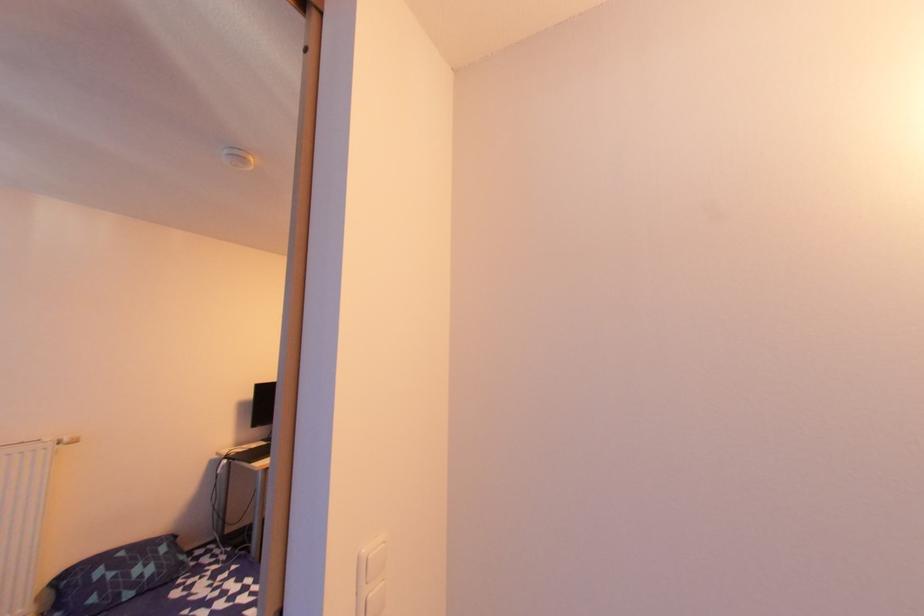
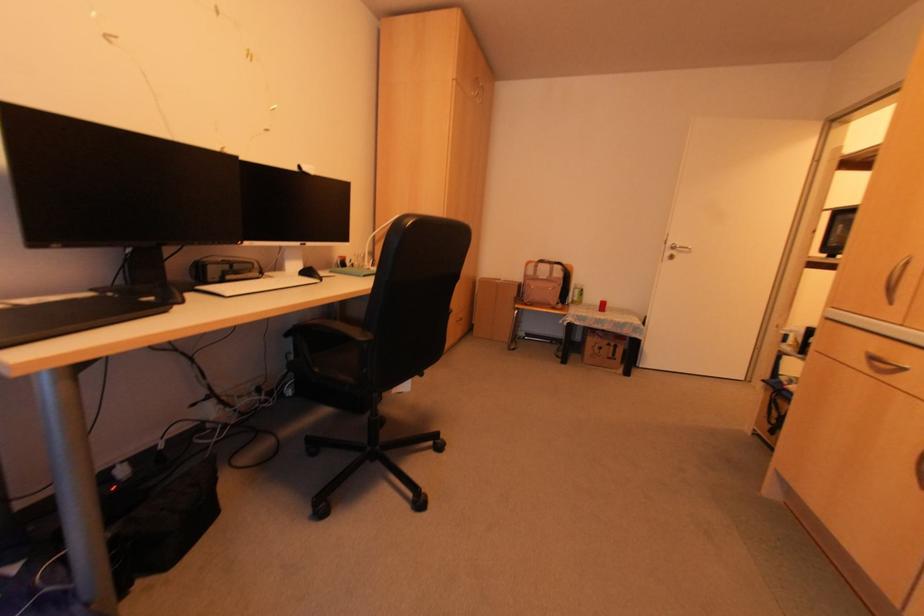
The images are taken continuously from a first-person perspective. In which direction are you moving?

The movement direction of the cameraman is left, forward.